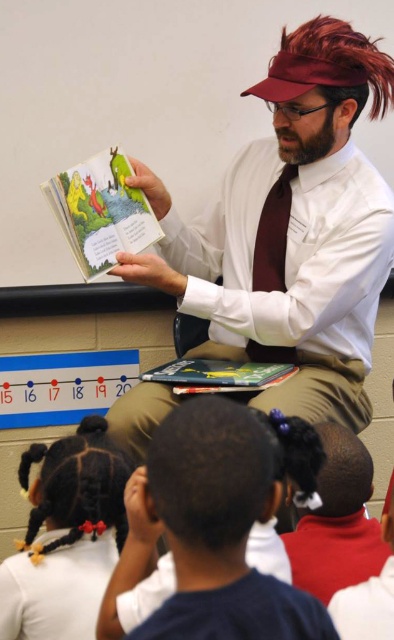
Question: Which point is closer to the camera?

Choices:
 (A) white glossy shirt at upper center
 (B) hardcover book at center

Answer: (A)

Question: Which point is farther from the camera taking this photo?

Choices:
 (A) (317, 49)
 (B) (267, 212)
 (C) (74, 480)

Answer: (B)

Question: Which point is closer to the camera?

Choices:
 (A) black hair at lower center
 (B) matte green book at upper center

Answer: (A)

Question: Is white glossy shirt at upper center thinner than matte green book at upper center?

Choices:
 (A) yes
 (B) no

Answer: (B)

Question: Is white glossy shirt at upper center below hardcover book at center?

Choices:
 (A) yes
 (B) no

Answer: (B)

Question: From the image, what is the correct spatial relationship of matte green book at upper center in relation to maroon satin tie at center?

Choices:
 (A) left
 (B) right

Answer: (A)